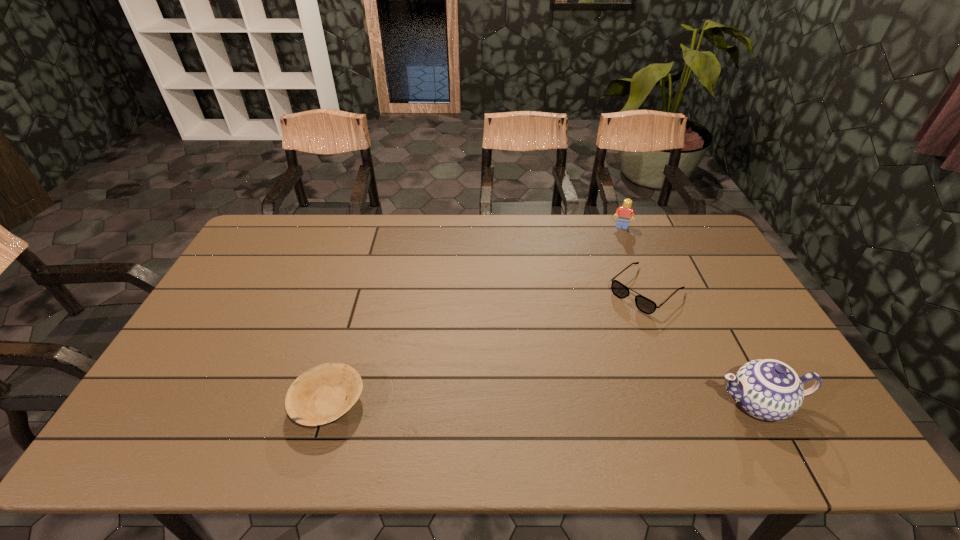
I want to click on blank region between the tallest object and the spectacles, so click(x=702, y=346).

Where is `free space between the chinaware and the bowl`? free space between the chinaware and the bowl is located at coordinates (543, 403).

This screenshot has width=960, height=540. In order to click on vacant area that lies between the leftmost object and the second farthest object in this screenshot , I will do `click(488, 347)`.

Locate an element on the screen. vacant space that is in between the spectacles and the second tallest object is located at coordinates (634, 258).

Select which object appears as the second closest to the leftmost object. Please provide its 2D coordinates. Your answer should be formatted as a tuple, i.e. [(x, y)], where the tuple contains the x and y coordinates of a point satisfying the conditions above.

[(768, 389)]

Where is `the third closest object to the third nearest object`? The width and height of the screenshot is (960, 540). the third closest object to the third nearest object is located at coordinates (318, 396).

Where is `free space that satisfies the following two spatial constraints: 1. on the front side of the spectacles; 2. at the spout of the tallest object`? The height and width of the screenshot is (540, 960). free space that satisfies the following two spatial constraints: 1. on the front side of the spectacles; 2. at the spout of the tallest object is located at coordinates (691, 403).

I want to click on free space that satisfies the following two spatial constraints: 1. on the back side of the second tallest object; 2. on the left side of the leftmost object, so click(380, 226).